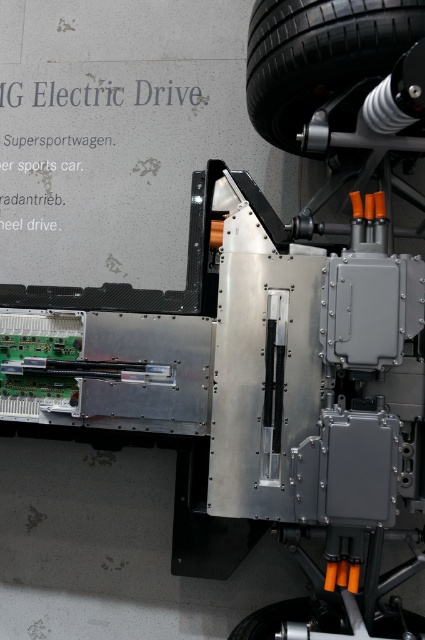
Question: Can you confirm if black rubber tire at upper right is positioned below black rubber tire at lower right?

Choices:
 (A) no
 (B) yes

Answer: (A)

Question: Which object is closer to the camera taking this photo?

Choices:
 (A) black rubber tire at upper right
 (B) black rubber tire at lower right

Answer: (A)

Question: Is black rubber tire at upper right positioned behind black rubber tire at lower right?

Choices:
 (A) no
 (B) yes

Answer: (A)

Question: Does black rubber tire at upper right appear on the right side of black rubber tire at lower right?

Choices:
 (A) yes
 (B) no

Answer: (B)

Question: Which point is farther to the camera?

Choices:
 (A) (309, 108)
 (B) (277, 618)

Answer: (B)